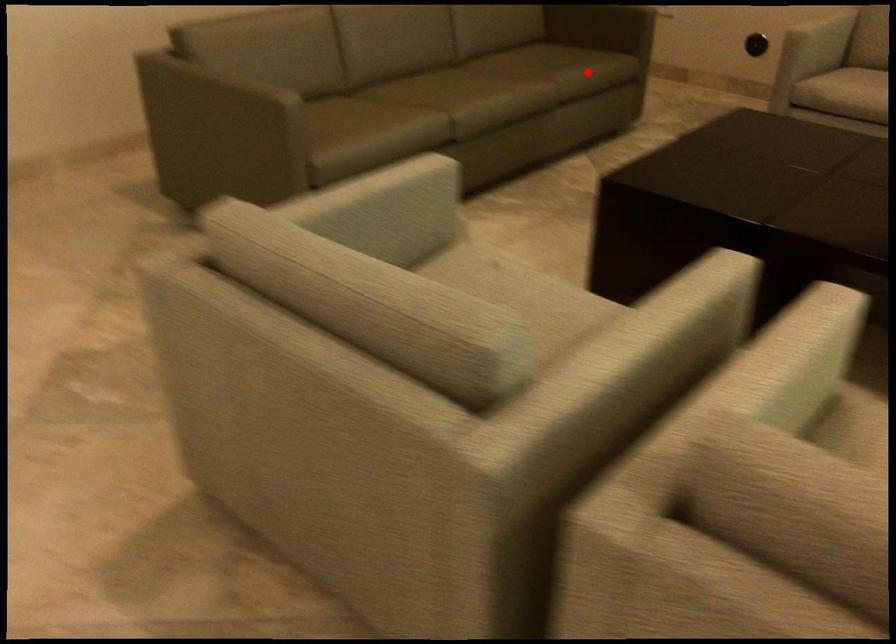
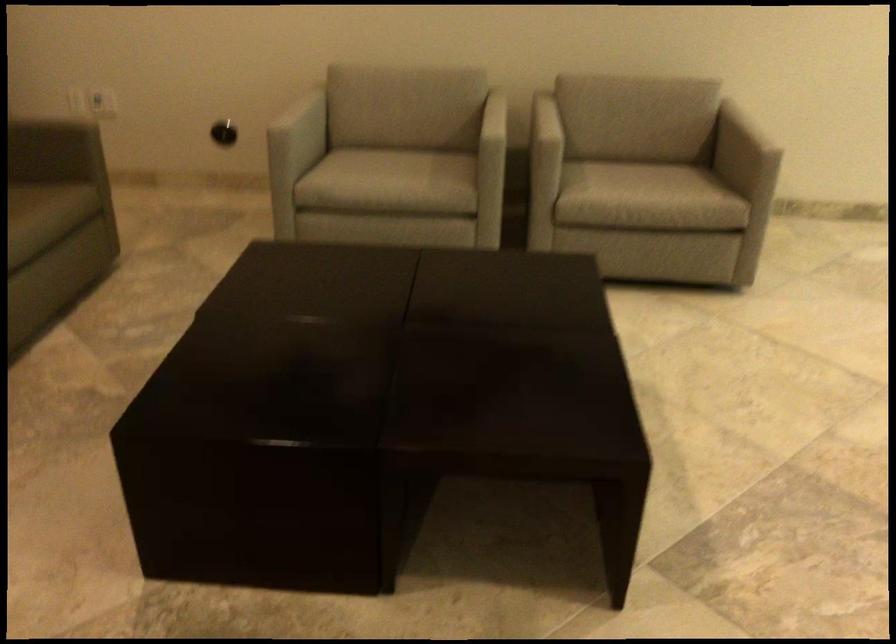
Find the pixel in the second image that matches the highlighted location in the first image.

(36, 219)